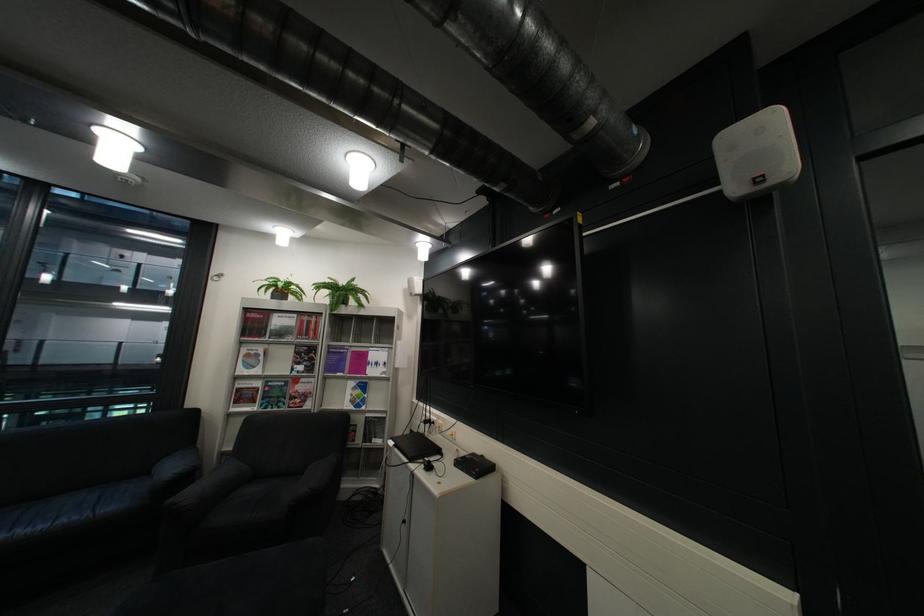
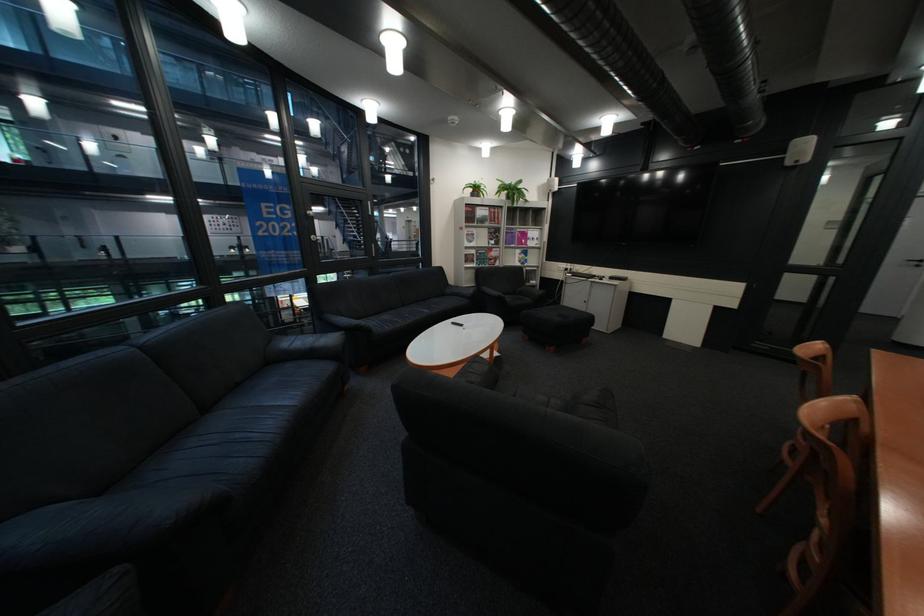
Where in the second image is the point corresponding to pixel 311 353 from the first image?

(505, 233)